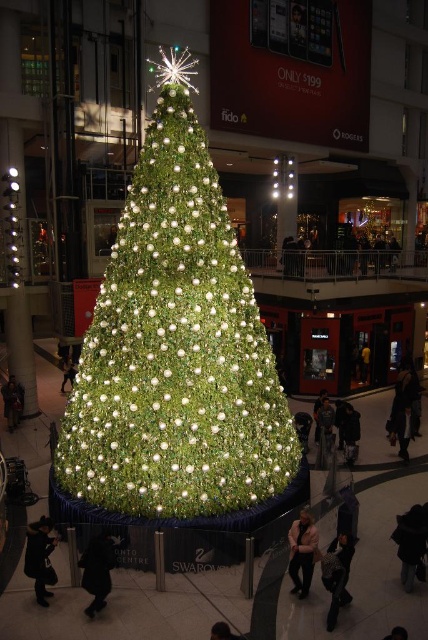
You are standing in the shopping mall atrium and see the large Christmas tree. There is a black fuzzy coat located at point (410, 541). Can you tell me where the black fuzzy coat is in relation to the Christmas tree?

The point (410, 541) marks the location of the black fuzzy coat at lower right, which means it is positioned to the lower right side of the Christmas tree.

You are standing at the entrance of the mall atrium and see two points marked on the floor near the Christmas tree. The first point is at coordinates point (101,557) and the second is at point (297,588). If you walk towards the Christmas tree, which point will you pass over first?

Point (101,557) is in front of point (297,588), so you will pass over point (101,557) first as you walk towards the Christmas tree.

You are a delivery person who needs to place a gift box between the black fabric coat at lower left and the dark gray sweater at center. The gift box requires a space of 10 feet. Is there enough space between them?

The black fabric coat at lower left is 14.16 feet from the dark gray sweater at center, so yes, there is enough space to place the gift box between them as the distance is greater than the required 10 feet.